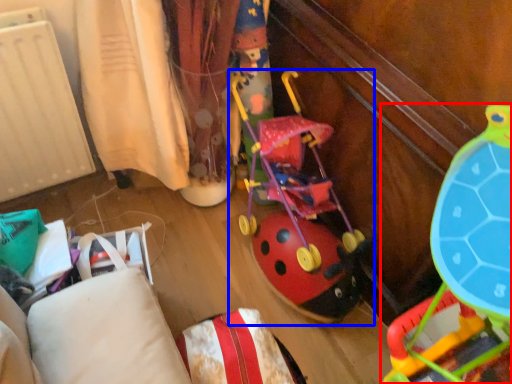
Question: Among these objects, which one is farthest to the camera, toy (highlighted by a red box) or toy (highlighted by a blue box)?

Choices:
 (A) toy
 (B) toy

Answer: (B)